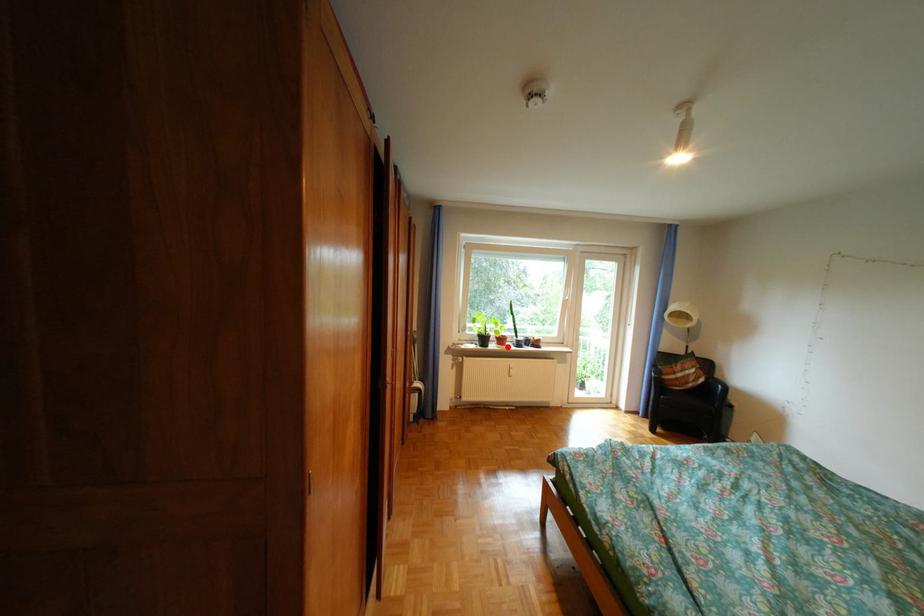
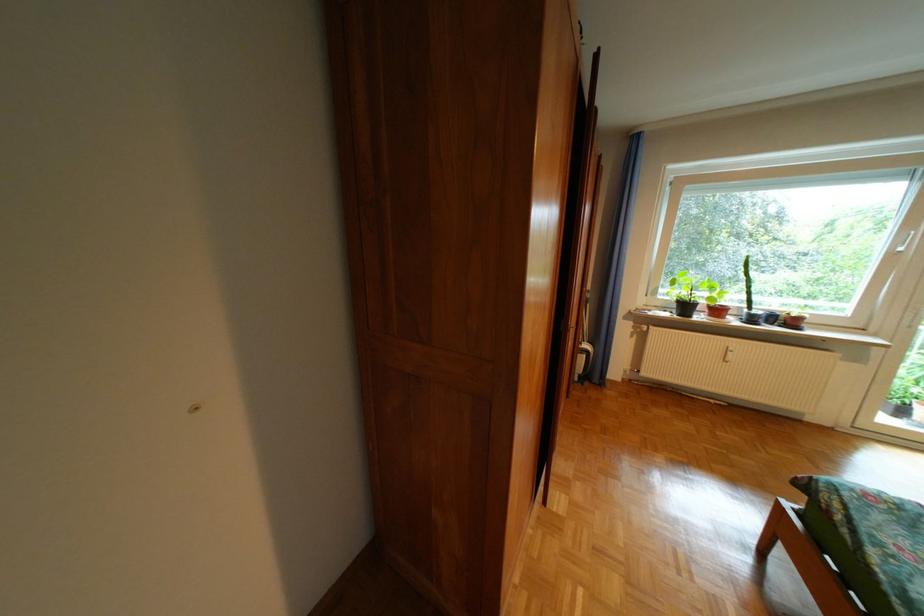
The point at the highlighted location is marked in the first image. Where is the corresponding point in the second image?

(714, 318)